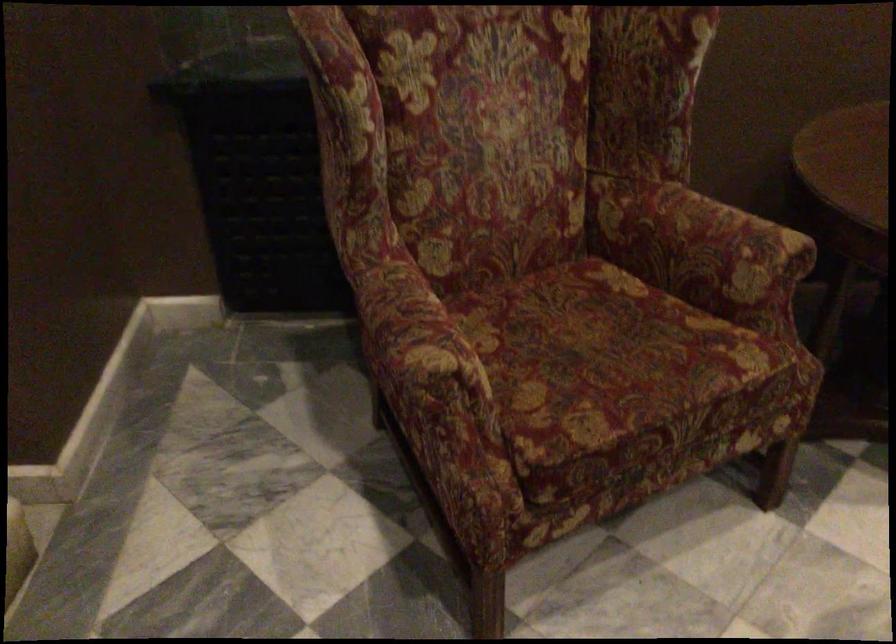
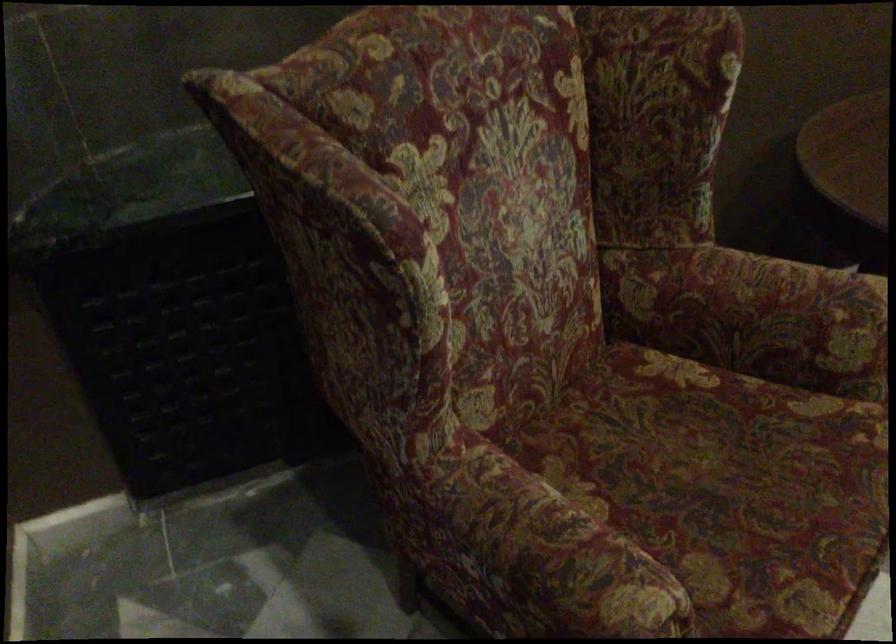
The point at (708, 252) is marked in the first image. Where is the corresponding point in the second image?

(786, 321)